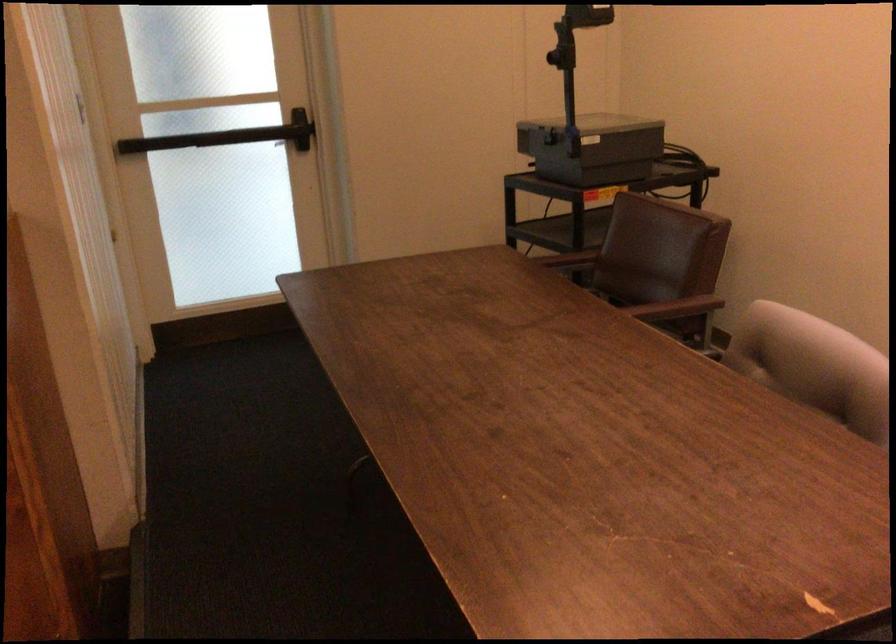
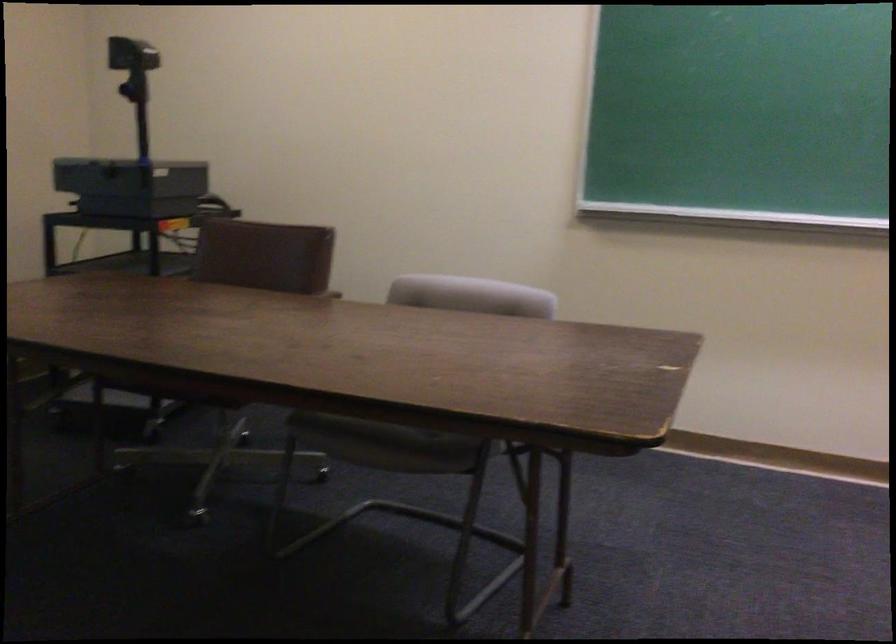
Question: I am providing you with two images of the same scene from different viewpoints. Which of the following objects are not visible in image2?

Choices:
 (A) brown chair armrest
 (B) black overhead projector
 (C) colorful activity cube
 (D) projector head

Answer: (A)